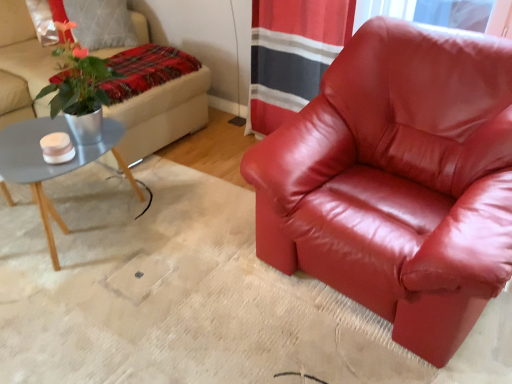
Question: Does satin red armchair at center turn towards plaid fabric blanket at upper left?

Choices:
 (A) no
 (B) yes

Answer: (A)

Question: Is satin red armchair at center taller than plaid fabric blanket at upper left?

Choices:
 (A) yes
 (B) no

Answer: (A)

Question: Considering the relative positions of satin red armchair at center and plaid fabric blanket at upper left in the image provided, is satin red armchair at center in front of plaid fabric blanket at upper left?

Choices:
 (A) no
 (B) yes

Answer: (B)

Question: Is satin red armchair at center bigger than plaid fabric blanket at upper left?

Choices:
 (A) no
 (B) yes

Answer: (B)

Question: Is the position of satin red armchair at center more distant than that of plaid fabric blanket at upper left?

Choices:
 (A) no
 (B) yes

Answer: (A)

Question: Is point (48, 64) positioned closer to the camera than point (165, 74)?

Choices:
 (A) closer
 (B) farther

Answer: (B)

Question: Would you say beige fabric studio couch at upper left is to the left or to the right of plaid fabric blanket at upper left in the picture?

Choices:
 (A) left
 (B) right

Answer: (A)

Question: In terms of size, does beige fabric studio couch at upper left appear bigger or smaller than plaid fabric blanket at upper left?

Choices:
 (A) small
 (B) big

Answer: (B)

Question: Considering the positions of beige fabric studio couch at upper left and plaid fabric blanket at upper left in the image, is beige fabric studio couch at upper left wider or thinner than plaid fabric blanket at upper left?

Choices:
 (A) thin
 (B) wide

Answer: (B)

Question: Looking at the image, does plaid fabric blanket at upper left seem bigger or smaller compared to beige fabric studio couch at upper left?

Choices:
 (A) big
 (B) small

Answer: (B)

Question: Which is correct: plaid fabric blanket at upper left is inside beige fabric studio couch at upper left, or outside of it?

Choices:
 (A) inside
 (B) outside

Answer: (A)

Question: From a real-world perspective, is plaid fabric blanket at upper left above or below beige fabric studio couch at upper left?

Choices:
 (A) below
 (B) above

Answer: (B)

Question: Is plaid fabric blanket at upper left to the left or to the right of beige fabric studio couch at upper left in the image?

Choices:
 (A) right
 (B) left

Answer: (A)

Question: Based on their positions, is matte gray coffee table at left located to the left or right of plaid fabric blanket at upper left?

Choices:
 (A) left
 (B) right

Answer: (A)

Question: From a real-world perspective, relative to plaid fabric blanket at upper left, is matte gray coffee table at left vertically above or below?

Choices:
 (A) above
 (B) below

Answer: (B)